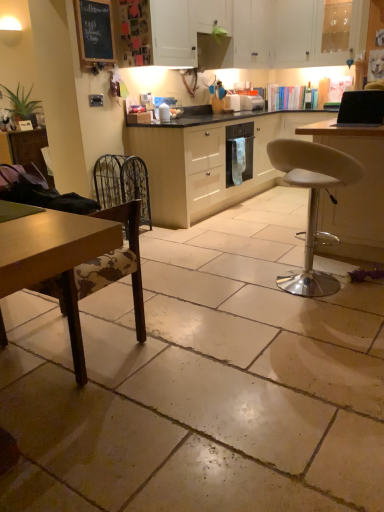
In order to click on free space that is in between white plastic table at right and wooden chair at lower left, which is counted as the 1th chair, starting from the left in this screenshot , I will do `click(210, 292)`.